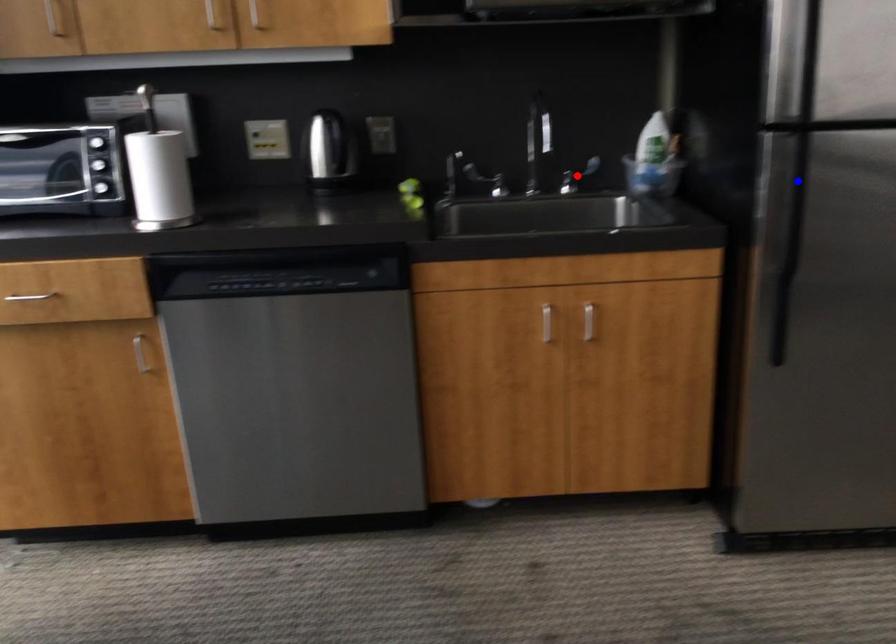
Question: In the image, two points are highlighted. Which point is nearer to the camera? Reply with the corresponding letter.

Choices:
 (A) blue point
 (B) red point

Answer: (A)